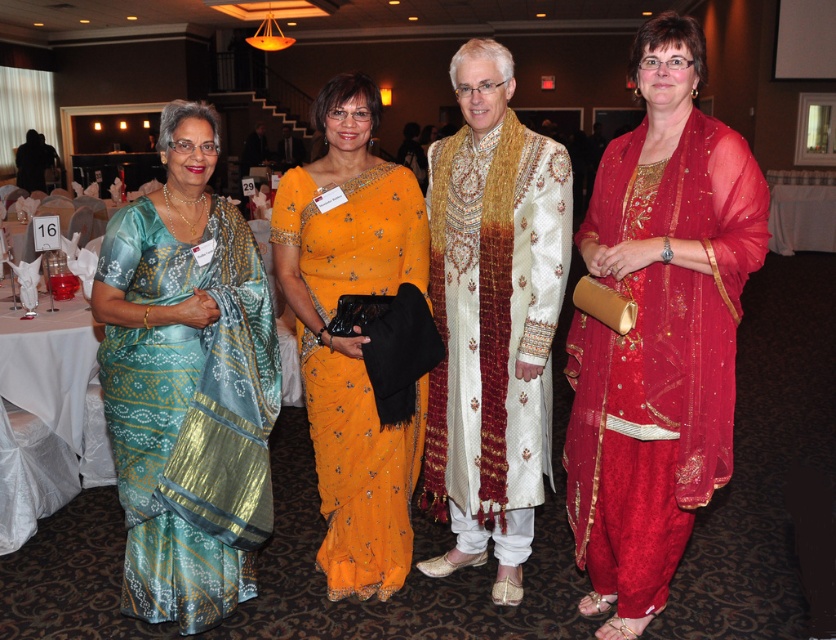
Question: Among these objects, which one is farthest from the camera?

Choices:
 (A) white silk sherwani at center
 (B) teal silk saree at left
 (C) red sheer dupatta at center

Answer: (A)

Question: Is red sheer dupatta at center smaller than white silk sherwani at center?

Choices:
 (A) no
 (B) yes

Answer: (A)

Question: Which of these objects is positioned closest to the orange silk saree at center?

Choices:
 (A) red sheer dupatta at center
 (B) teal silk saree at left

Answer: (B)

Question: Estimate the real-world distances between objects in this image. Which object is closer to the orange silk saree at center?

Choices:
 (A) white silk sherwani at center
 (B) teal silk saree at left

Answer: (A)

Question: Is red sheer dupatta at center above white silk sherwani at center?

Choices:
 (A) yes
 (B) no

Answer: (B)

Question: Can you confirm if red sheer dupatta at center is thinner than teal silk saree at left?

Choices:
 (A) yes
 (B) no

Answer: (A)